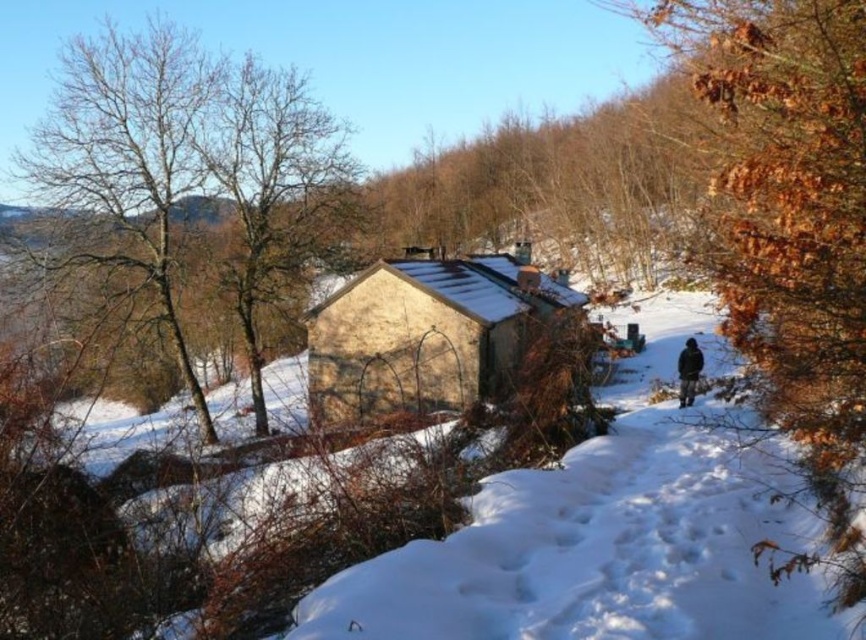
Question: Does bare wood tree at upper left have a larger size compared to black woolen jacket at lower right?

Choices:
 (A) yes
 (B) no

Answer: (A)

Question: Among these objects, which one is farthest from the camera?

Choices:
 (A) yellow stucco cabin at center
 (B) black woolen jacket at lower right
 (C) bare wood tree at upper left

Answer: (C)

Question: Which object is farther from the camera taking this photo?

Choices:
 (A) bare wood tree at upper left
 (B) black woolen jacket at lower right
 (C) yellow stucco cabin at center

Answer: (A)

Question: Can you confirm if yellow stucco cabin at center is wider than black woolen jacket at lower right?

Choices:
 (A) no
 (B) yes

Answer: (B)

Question: Can you confirm if bare wood tree at upper left is thinner than black woolen jacket at lower right?

Choices:
 (A) no
 (B) yes

Answer: (A)

Question: Which point is closer to the camera?

Choices:
 (A) black woolen jacket at lower right
 (B) yellow stucco cabin at center
 (C) bare wood tree at upper left

Answer: (B)